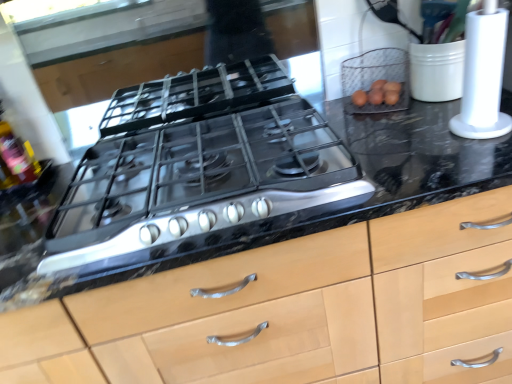
The height and width of the screenshot is (384, 512). What do you see at coordinates (16, 159) in the screenshot?
I see `translucent plastic bottle at left` at bounding box center [16, 159].

Measure the distance between point (499, 51) and camera.

Point (499, 51) and camera are 33.11 inches apart from each other.

Find the location of a particular element. wire mesh basket at upper right is located at coordinates (375, 78).

From the image's perspective, is white plastic paper towel holder at right located above or below wire mesh basket at upper right?

From the image's perspective, white plastic paper towel holder at right appears below wire mesh basket at upper right.

Does white plastic paper towel holder at right have a larger size compared to wire mesh basket at upper right?

Indeed, white plastic paper towel holder at right has a larger size compared to wire mesh basket at upper right.

What's the angular difference between white plastic paper towel holder at right and wire mesh basket at upper right's facing directions?

The angular difference between white plastic paper towel holder at right and wire mesh basket at upper right is 29.5 degrees.

Would you say wire mesh basket at upper right is part of white plastic paper towel holder at right's contents?

No, wire mesh basket at upper right is not a part of white plastic paper towel holder at right.

Find the location of a particular element. countertop in front of the wire mesh basket at upper right is located at coordinates (311, 207).

Could you tell me if black marble countertop at center is facing wire mesh basket at upper right?

No.

From the image's perspective, which one is positioned lower, black marble countertop at center or wire mesh basket at upper right?

black marble countertop at center.

Is wire mesh basket at upper right completely or partially inside translucent plastic bottle at left?

No, wire mesh basket at upper right is located outside of translucent plastic bottle at left.

Are translucent plastic bottle at left and wire mesh basket at upper right making contact?

No, translucent plastic bottle at left is not with wire mesh basket at upper right.

Could you tell me if translucent plastic bottle at left is turned towards wire mesh basket at upper right?

No.

Can you confirm if translucent plastic bottle at left is bigger than wire mesh basket at upper right?

No, translucent plastic bottle at left is not bigger than wire mesh basket at upper right.

Is wire mesh basket at upper right wider or thinner than white plastic paper towel holder at right?

Clearly, wire mesh basket at upper right has more width compared to white plastic paper towel holder at right.

From the image's perspective, is wire mesh basket at upper right positioned above or below white plastic paper towel holder at right?

From the image's perspective, wire mesh basket at upper right appears above white plastic paper towel holder at right.

Consider the image. Which object is closer to the camera, wire mesh basket at upper right or white plastic paper towel holder at right?

white plastic paper towel holder at right.

Does wire mesh basket at upper right have a greater height compared to white plastic paper towel holder at right?

No, wire mesh basket at upper right is not taller than white plastic paper towel holder at right.

From the image's perspective, is wire mesh basket at upper right on black marble countertop at center?

Yes, from the image's perspective, wire mesh basket at upper right is on top of black marble countertop at center.

Which is more to the left, wire mesh basket at upper right or black marble countertop at center?

black marble countertop at center is more to the left.

Which of these two, wire mesh basket at upper right or black marble countertop at center, stands shorter?

wire mesh basket at upper right is shorter.

How far apart are wire mesh basket at upper right and black marble countertop at center?

They are 10.03 inches apart.

Is black marble countertop at center not near white plastic paper towel holder at right?

They are positioned close to each other.

Is white plastic paper towel holder at right located within black marble countertop at center?

Definitely not — white plastic paper towel holder at right is not inside black marble countertop at center.

In terms of width, does black marble countertop at center look wider or thinner when compared to white plastic paper towel holder at right?

In the image, black marble countertop at center appears to be wider than white plastic paper towel holder at right.

Is point (388, 70) closer or farther from the camera than point (30, 163)?

Clearly, point (388, 70) is more distant from the camera than point (30, 163).

How different are the orientations of wire mesh basket at upper right and translucent plastic bottle at left in degrees?

wire mesh basket at upper right and translucent plastic bottle at left are facing 29.6 degrees away from each other.

Is wire mesh basket at upper right positioned in front of translucent plastic bottle at left?

No, it is not.

Which of these two, wire mesh basket at upper right or translucent plastic bottle at left, is wider?

Wider between the two is wire mesh basket at upper right.

Identify the location of kitchen appliance below the wire mesh basket at upper right (from the image's perspective). The image size is (512, 384). (483, 75).

The height and width of the screenshot is (384, 512). Identify the location of countertop in front of the wire mesh basket at upper right. (311, 207).

From the image, which object appears to be nearer to wire mesh basket at upper right, black marble countertop at center or translucent plastic bottle at left?

Based on the image, black marble countertop at center appears to be nearer to wire mesh basket at upper right.

From the image, which object appears to be nearer to black marble countertop at center, translucent plastic bottle at left or white plastic paper towel holder at right?

white plastic paper towel holder at right.

Which object lies further to the anchor point white plastic paper towel holder at right, translucent plastic bottle at left or black marble countertop at center?

translucent plastic bottle at left.

From the image, which object appears to be farther from wire mesh basket at upper right, black marble countertop at center or white plastic paper towel holder at right?

white plastic paper towel holder at right lies further to wire mesh basket at upper right than the other object.

Looking at the image, which one is located closer to white plastic paper towel holder at right, black marble countertop at center or wire mesh basket at upper right?

black marble countertop at center is positioned closer to the anchor white plastic paper towel holder at right.

Which object lies further to the anchor point wire mesh basket at upper right, white plastic paper towel holder at right or black marble countertop at center?

white plastic paper towel holder at right.

When comparing their distances from wire mesh basket at upper right, does white plastic paper towel holder at right or translucent plastic bottle at left seem further?

translucent plastic bottle at left is positioned further to the anchor wire mesh basket at upper right.

Estimate the real-world distances between objects in this image. Which object is further from black marble countertop at center, wire mesh basket at upper right or translucent plastic bottle at left?

translucent plastic bottle at left lies further to black marble countertop at center than the other object.

Locate an element on the screen. The image size is (512, 384). appliance between translucent plastic bottle at left and white plastic paper towel holder at right from left to right is located at coordinates (375, 78).

Identify the location of countertop between translucent plastic bottle at left and white plastic paper towel holder at right. (311, 207).

Locate an element on the screen. The height and width of the screenshot is (384, 512). countertop located between translucent plastic bottle at left and wire mesh basket at upper right in the left-right direction is located at coordinates (311, 207).

What are the coordinates of `kitchen appliance between wire mesh basket at upper right and black marble countertop at center from top to bottom` in the screenshot? It's located at (483, 75).